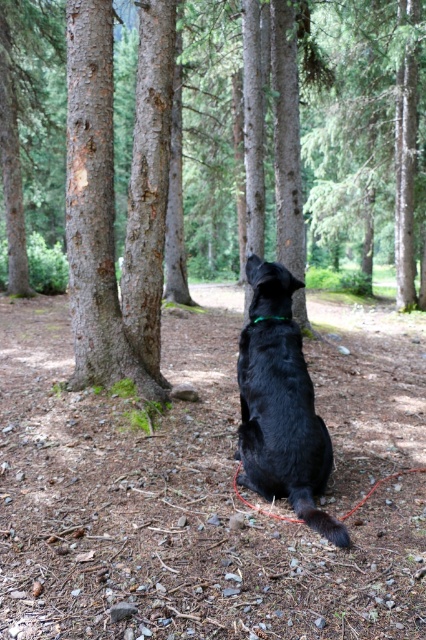
Question: Is rough bark trees at left to the right of shiny black dog at center from the viewer's perspective?

Choices:
 (A) yes
 (B) no

Answer: (B)

Question: Based on their relative distances, which object is farther from the shiny black dog at center?

Choices:
 (A) green fabric neckband at center
 (B) rough bark trees at left

Answer: (B)

Question: Can you confirm if shiny black dog at center is smaller than green fabric neckband at center?

Choices:
 (A) yes
 (B) no

Answer: (B)

Question: Which of the following is the closest to the observer?

Choices:
 (A) rough bark trees at left
 (B) shiny black dog at center
 (C) green fabric neckband at center

Answer: (B)

Question: Can you confirm if rough bark trees at left is bigger than shiny black dog at center?

Choices:
 (A) no
 (B) yes

Answer: (B)

Question: Which point is farther to the camera?

Choices:
 (A) (261, 413)
 (B) (259, 320)

Answer: (B)